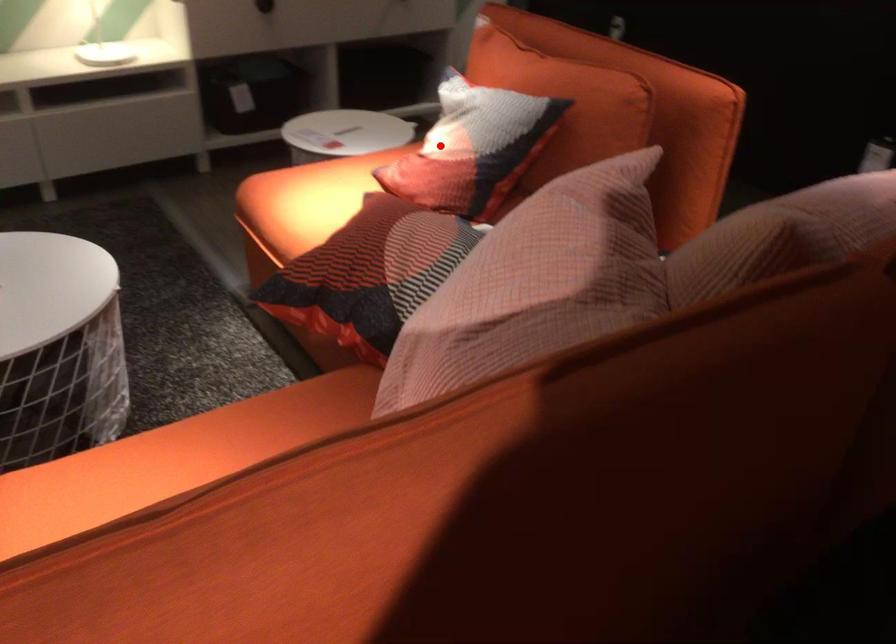
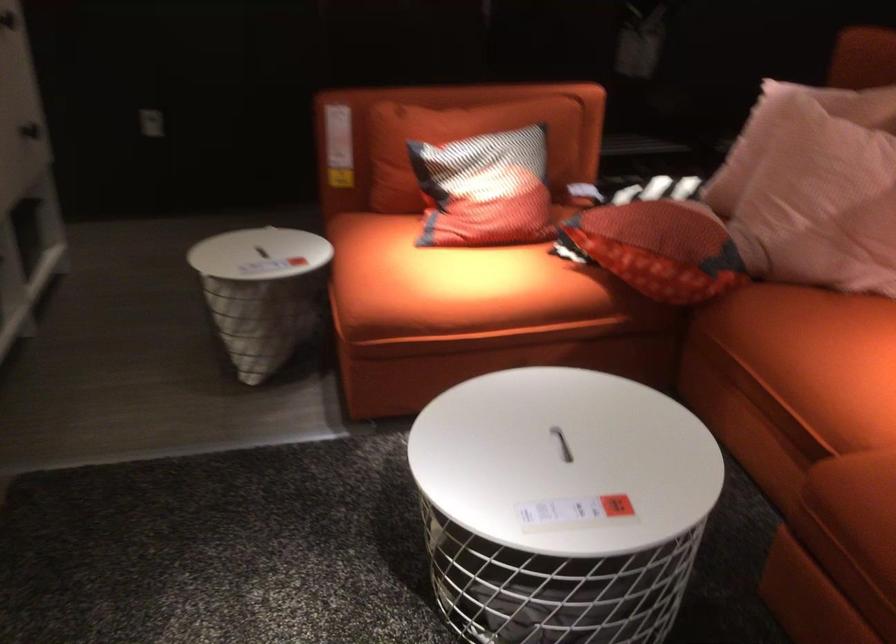
Question: I am providing you with two images of the same scene from different viewpoints. In image1, a red point is highlighted. Considering the same 3D point in image2, which of the following is correct?

Choices:
 (A) It is closer
 (B) It is farther

Answer: (B)